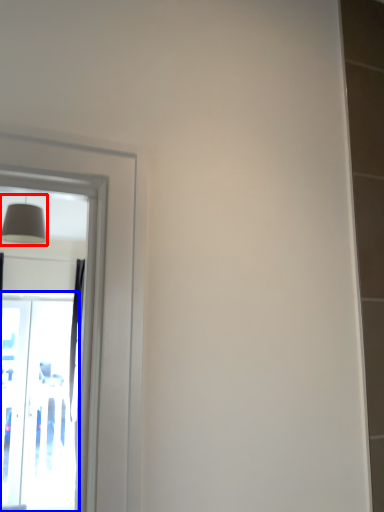
Question: Among these objects, which one is farthest to the camera, lamp (highlighted by a red box) or screen door (highlighted by a blue box)?

Choices:
 (A) lamp
 (B) screen door

Answer: (B)